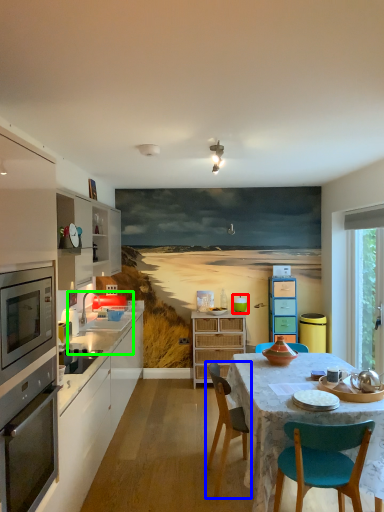
Question: Based on their relative distances, which object is farther from teal (highlighted by a red box)? Choose from chair (highlighted by a blue box) and sink (highlighted by a green box).

Choices:
 (A) chair
 (B) sink

Answer: (A)